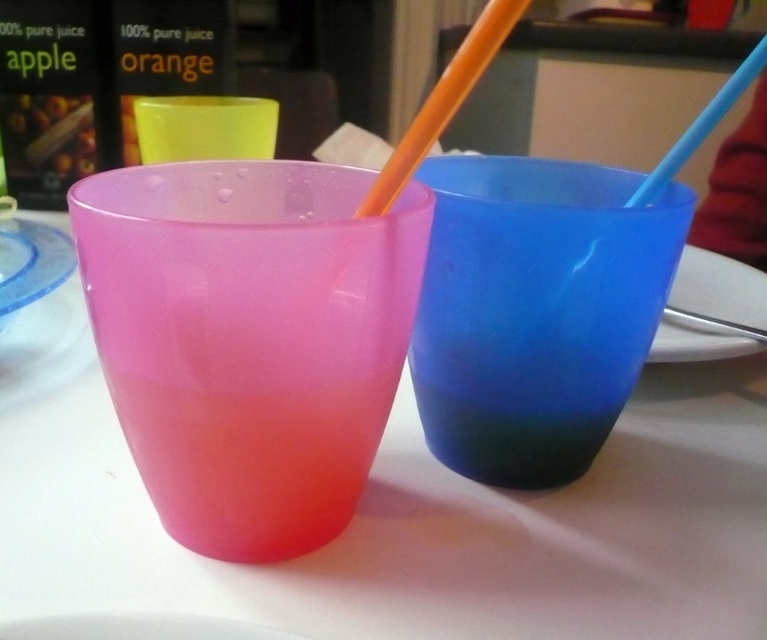
Question: Which point appears farthest from the camera in this image?

Choices:
 (A) (514, 320)
 (B) (41, 536)
 (C) (323, 336)

Answer: (A)

Question: Does frosted pink cup at left appear under transparent plastic plate at center?

Choices:
 (A) no
 (B) yes

Answer: (B)

Question: Does white glossy plate at lower center have a larger size compared to blue plastic straw at upper right?

Choices:
 (A) yes
 (B) no

Answer: (B)

Question: Which point is farther from the camera taking this photo?

Choices:
 (A) (x=236, y=525)
 (B) (x=621, y=228)
 (C) (x=413, y=148)

Answer: (B)

Question: Which of these objects is positioned closest to the transparent plastic plate at center?

Choices:
 (A) white glossy plate at lower center
 (B) orange plastic straw at center

Answer: (B)

Question: Does frosted pink cup at left have a greater width compared to yellow translucent cup at upper center?

Choices:
 (A) yes
 (B) no

Answer: (B)